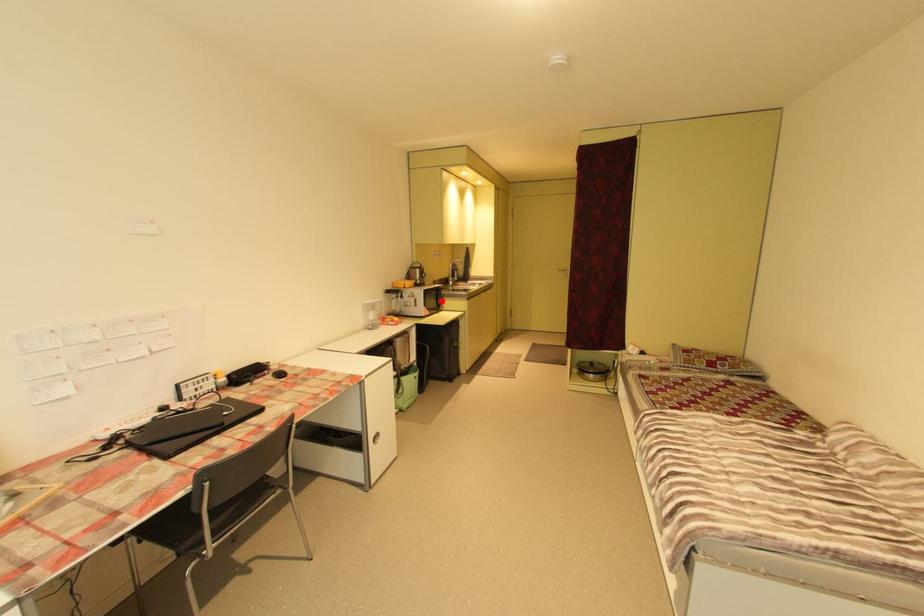
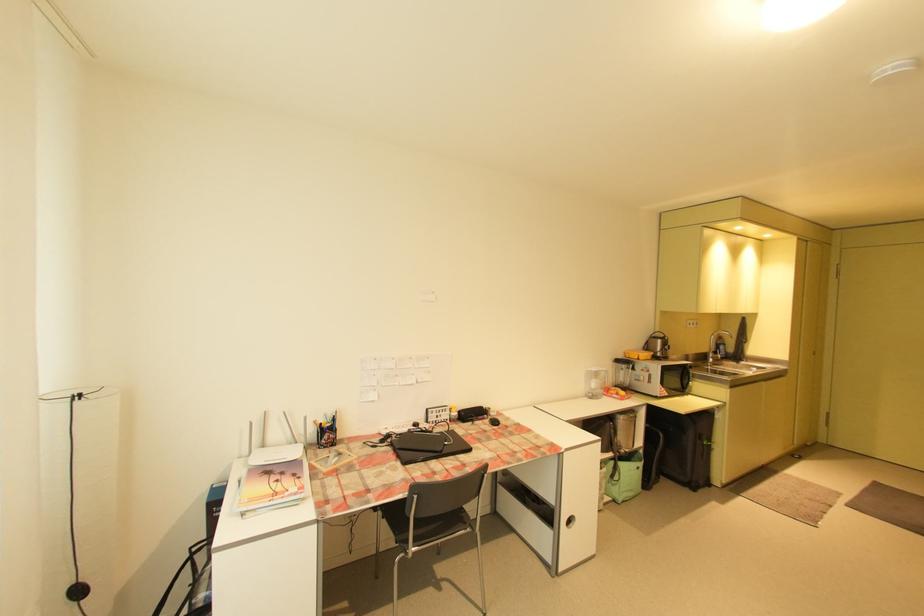
Where in the second image is the point corresponding to the highlighted location from the first image?

(686, 381)